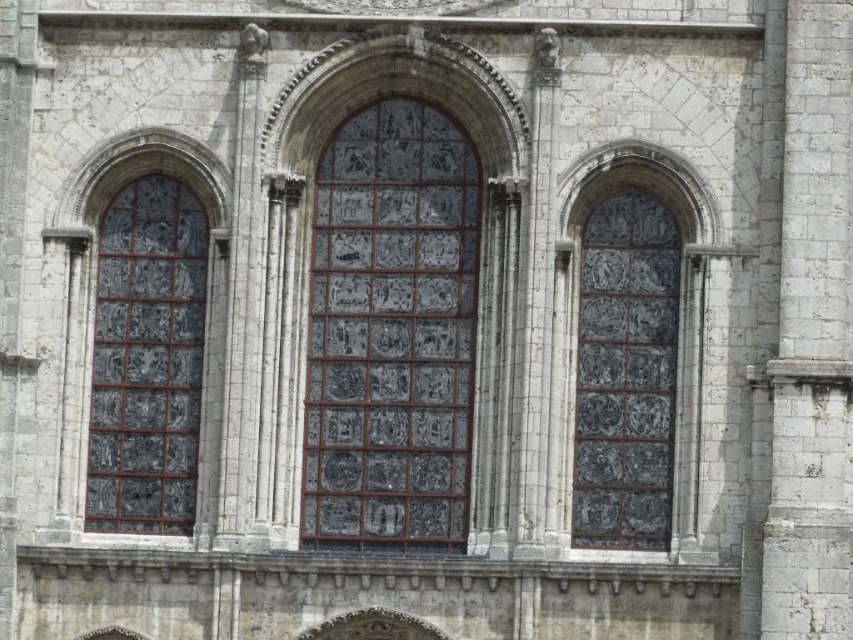
You are standing at a point 250.63 feet away from the camera, which is the point labeled as point (422, 324) in the image. You want to take a photo of the historic stone building with the central stained glass window in focus. Will you be able to capture the entire building in your photo if your camera has a standard 50mm lens?

The distance from point (422, 324) to the camera is 250.63 feet. With a standard 50mm lens, the field of view is typically around 46 degrees. At this distance, the entire building may not fit within the frame unless you move closer or use a wider lens. However, since the question specifies using a standard 50mm lens, it is unlikely the entire building will be captured in one photo.

In the scene shown: You are an architect examining the historic stone building. You notice the dark glass window at center and the stained glass window at left. Which one has a larger size?

The dark glass window at center is bigger than the stained glass window at left.

You are an architect planning to install a new decorative element between the stained glass window at center and the stained glass window at left. The decorative element requires a minimum of 20 feet of space. Based on the image, do you think there is enough space between them?

The distance between the stained glass window at center and the stained glass window at left is 20.28 feet, which is just enough to accommodate the decorative element requiring a minimum of 20 feet of space.